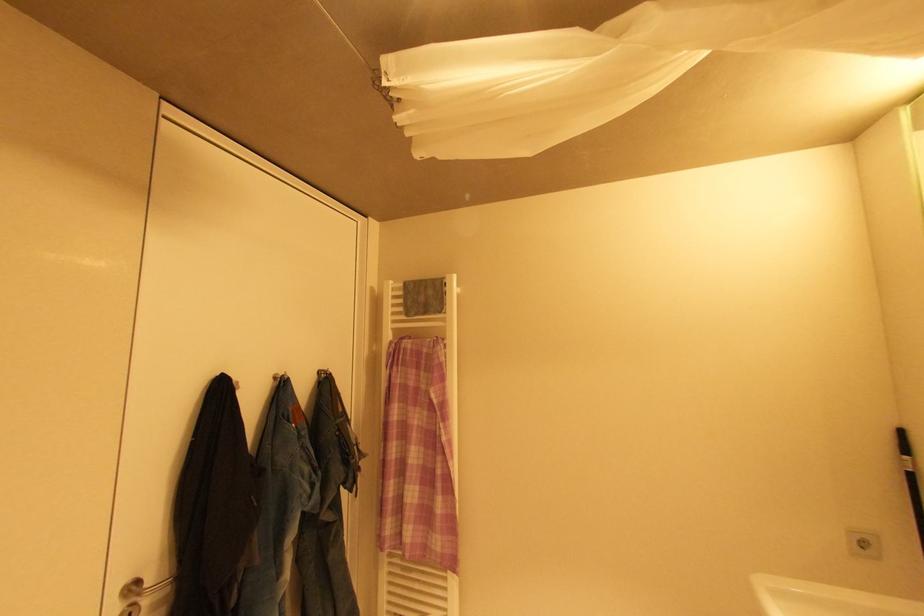
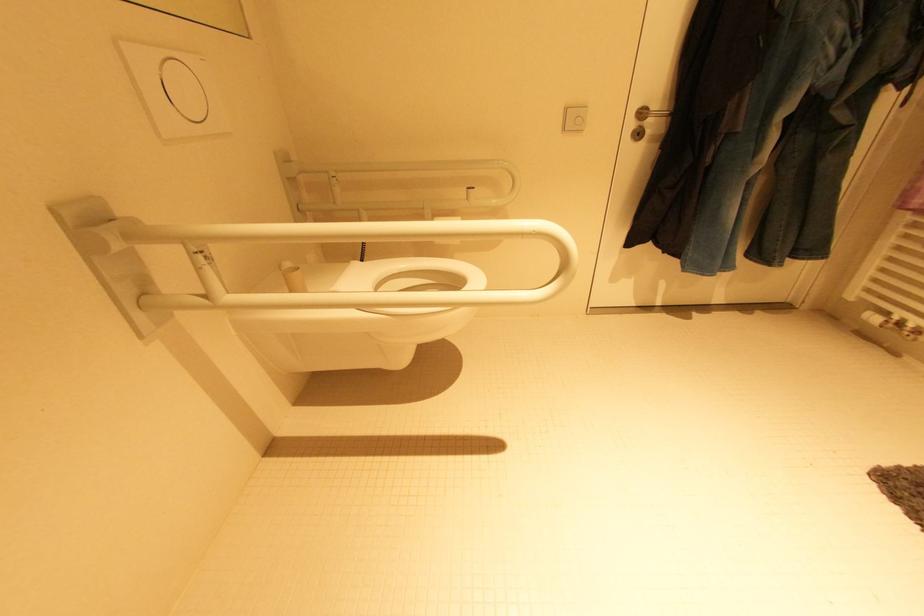
Consider the image. Based on the continuous images, in which direction is the camera rotating?

The camera rotated toward left-down.